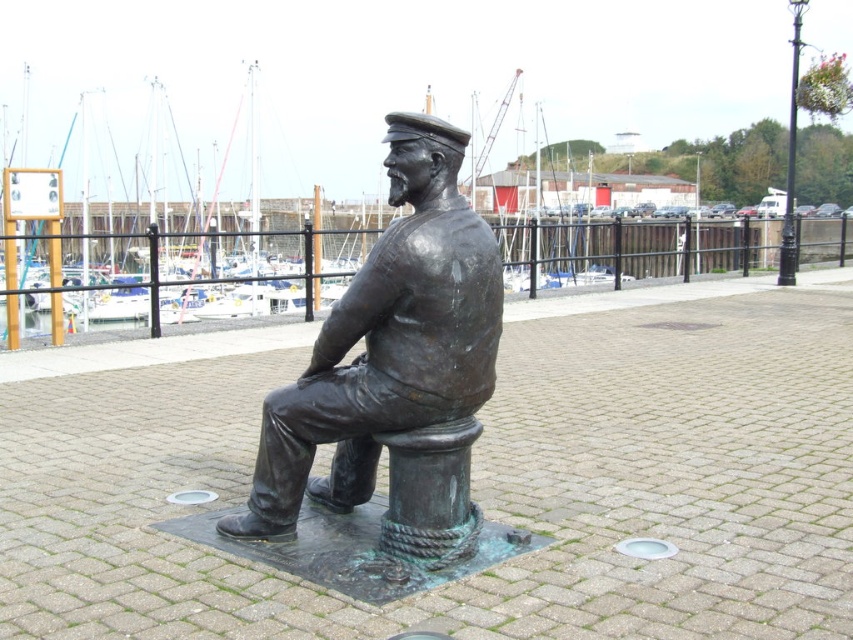
You are an artist planning to create a scale model of the bronze statue at center and the black wrought iron pole at upper right. If you want both models to fit on a display stand that is 1 meter wide, which object should you scale down more to ensure they both fit?

The bronze statue at center should be scaled down more because its actual width is less than the black wrought iron pole at upper right, so reducing its size proportionally would allow both to fit within the 1 meter width constraint.